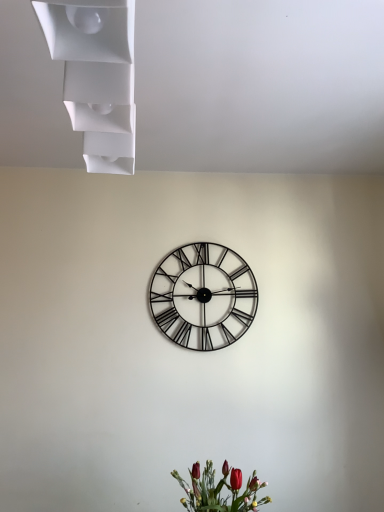
Question: Is metallic black clock at center further to camera compared to white matte shelf at upper left?

Choices:
 (A) no
 (B) yes

Answer: (B)

Question: From a real-world perspective, is metallic black clock at center on white matte shelf at upper left?

Choices:
 (A) yes
 (B) no

Answer: (B)

Question: Can you confirm if metallic black clock at center is wider than white matte shelf at upper left?

Choices:
 (A) yes
 (B) no

Answer: (B)

Question: Does metallic black clock at center have a lesser width compared to white matte shelf at upper left?

Choices:
 (A) yes
 (B) no

Answer: (A)

Question: Can you confirm if metallic black clock at center is smaller than white matte shelf at upper left?

Choices:
 (A) no
 (B) yes

Answer: (B)

Question: Considering the positions of point (41, 4) and point (241, 266), is point (41, 4) closer or farther from the camera than point (241, 266)?

Choices:
 (A) closer
 (B) farther

Answer: (A)

Question: From the image's perspective, is white matte shelf at upper left positioned above or below metallic black clock at center?

Choices:
 (A) below
 (B) above

Answer: (B)

Question: Relative to metallic black clock at center, is white matte shelf at upper left in front or behind?

Choices:
 (A) behind
 (B) front

Answer: (B)

Question: Do you think white matte shelf at upper left is within metallic black clock at center, or outside of it?

Choices:
 (A) inside
 (B) outside

Answer: (B)

Question: Considering the positions of point (129, 24) and point (241, 498), is point (129, 24) closer or farther from the camera than point (241, 498)?

Choices:
 (A) closer
 (B) farther

Answer: (A)

Question: From the image's perspective, is white matte shelf at upper left above or below matte red flowers at lower center?

Choices:
 (A) above
 (B) below

Answer: (A)

Question: Considering the positions of white matte shelf at upper left and matte red flowers at lower center in the image, is white matte shelf at upper left wider or thinner than matte red flowers at lower center?

Choices:
 (A) wide
 (B) thin

Answer: (B)

Question: In terms of height, does white matte shelf at upper left look taller or shorter compared to matte red flowers at lower center?

Choices:
 (A) short
 (B) tall

Answer: (B)

Question: In the image, is metallic black clock at center on the left side or the right side of matte red flowers at lower center?

Choices:
 (A) right
 (B) left

Answer: (B)

Question: Looking at their shapes, would you say metallic black clock at center is wider or thinner than matte red flowers at lower center?

Choices:
 (A) wide
 (B) thin

Answer: (B)